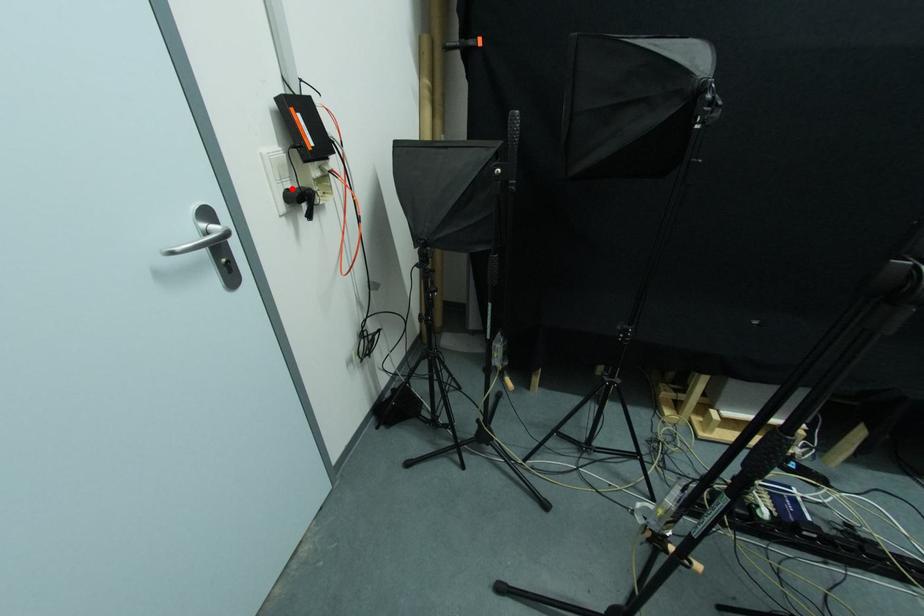
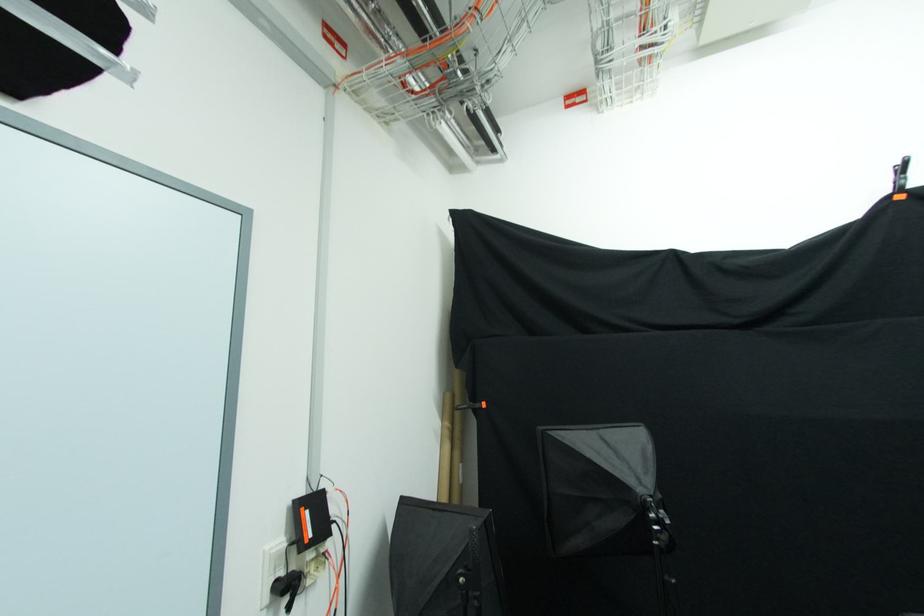
In the second image, find the point that corresponds to the highlighted location in the first image.

(285, 577)